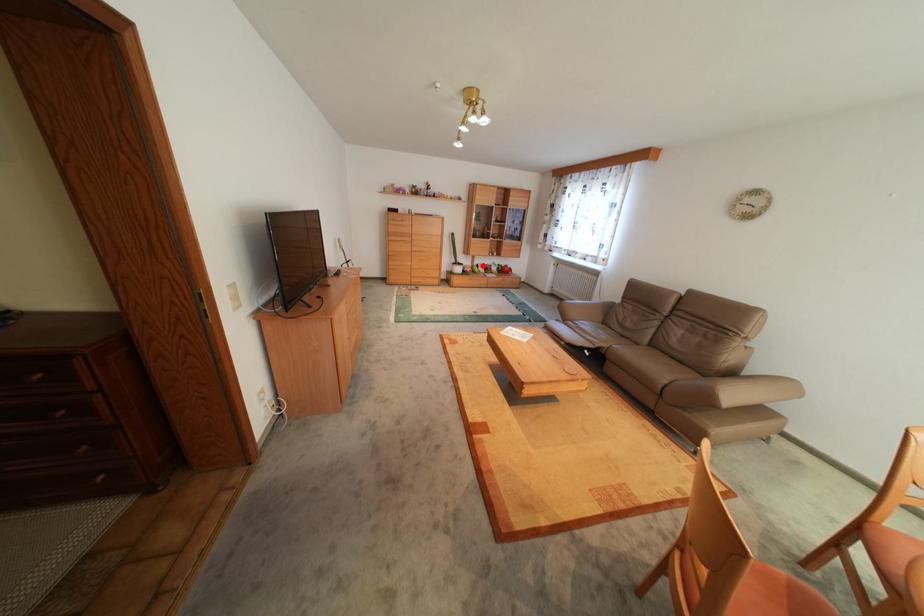
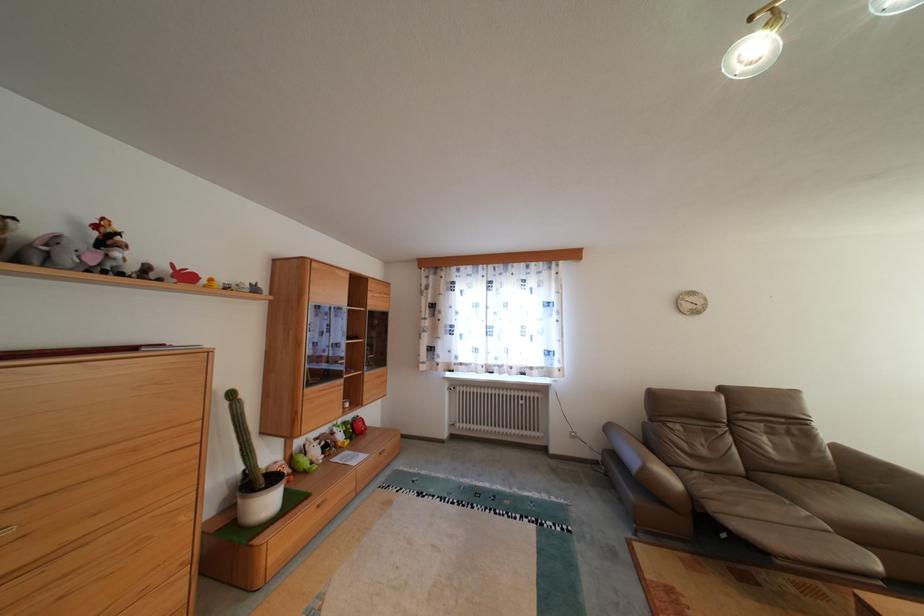
Locate, in the second image, the point that corresponds to the highlighted location in the first image.

(301, 460)